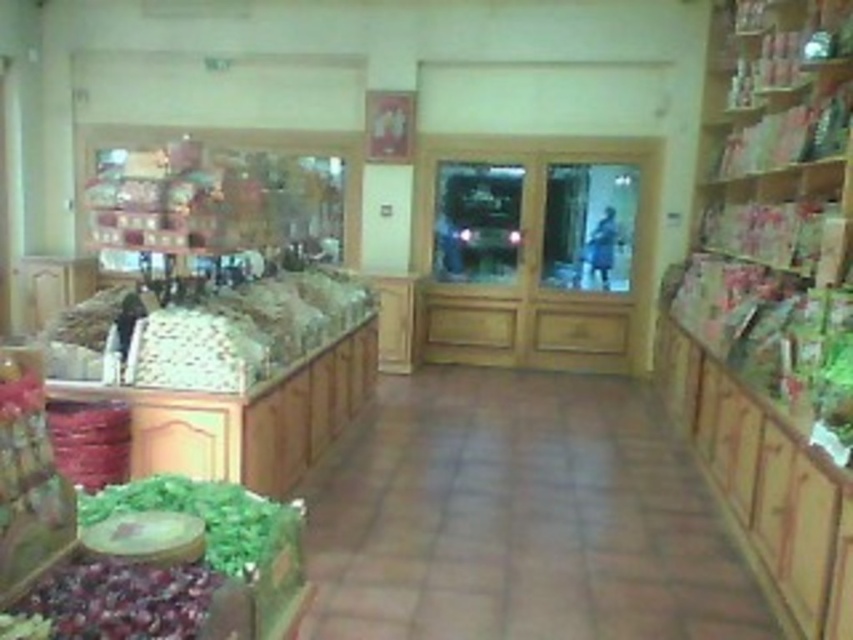
You are a customer in the grocery store and want to find the green textured herbs at center. According to the store layout, where exactly are they located?

The green textured herbs at center are located at point 0.517 on the x axis and 0.291 on the y axis.

You are a customer in the grocery store and want to reach the shiny purple grapes at lower left without disturbing the green textured herbs at center. Is the height difference between them a concern for your reach?

The green textured herbs at center are taller than the shiny purple grapes at lower left, so the grapes are lower and easier to reach without disturbing the herbs.